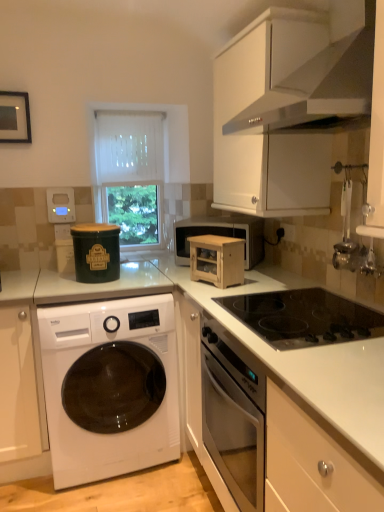
Question: Is white glossy washing machine at lower left smaller than white sheer curtain at center?

Choices:
 (A) yes
 (B) no

Answer: (B)

Question: Does white glossy washing machine at lower left have a greater width compared to white sheer curtain at center?

Choices:
 (A) yes
 (B) no

Answer: (A)

Question: Would you say white glossy washing machine at lower left contains white sheer curtain at center?

Choices:
 (A) no
 (B) yes

Answer: (A)

Question: From a real-world perspective, is white glossy washing machine at lower left under white sheer curtain at center?

Choices:
 (A) yes
 (B) no

Answer: (A)

Question: Are white glossy washing machine at lower left and white sheer curtain at center located far from each other?

Choices:
 (A) no
 (B) yes

Answer: (B)

Question: From a real-world perspective, relative to white matte exhaust hood at upper right, is white glossy washing machine at lower left vertically above or below?

Choices:
 (A) below
 (B) above

Answer: (A)

Question: Is point pyautogui.click(x=134, y=460) positioned closer to the camera than point pyautogui.click(x=370, y=35)?

Choices:
 (A) farther
 (B) closer

Answer: (A)

Question: In terms of width, does white glossy washing machine at lower left look wider or thinner when compared to white matte exhaust hood at upper right?

Choices:
 (A) wide
 (B) thin

Answer: (A)

Question: Is white glossy washing machine at lower left bigger or smaller than white matte exhaust hood at upper right?

Choices:
 (A) small
 (B) big

Answer: (B)

Question: Visually, is wooden cabinet at center, which is the 1th appliance from right to left, positioned to the left or to the right of wooden microwave at center?

Choices:
 (A) left
 (B) right

Answer: (A)

Question: From a real-world perspective, is wooden cabinet at center, the third appliance when ordered from back to front, physically located above or below wooden microwave at center?

Choices:
 (A) below
 (B) above

Answer: (A)

Question: Is wooden cabinet at center, the third appliance when ordered from back to front, bigger or smaller than wooden microwave at center?

Choices:
 (A) big
 (B) small

Answer: (B)

Question: In terms of width, does wooden cabinet at center, marked as the 3th appliance in a left-to-right arrangement, look wider or thinner when compared to wooden microwave at center?

Choices:
 (A) wide
 (B) thin

Answer: (B)

Question: In terms of width, does black glass cooktop at center look wider or thinner when compared to green matte container at upper left, acting as the second appliance starting from the left?

Choices:
 (A) wide
 (B) thin

Answer: (A)

Question: Considering the positions of black glass cooktop at center and green matte container at upper left, acting as the second appliance starting from the back, in the image, is black glass cooktop at center taller or shorter than green matte container at upper left, acting as the second appliance starting from the back,?

Choices:
 (A) short
 (B) tall

Answer: (A)